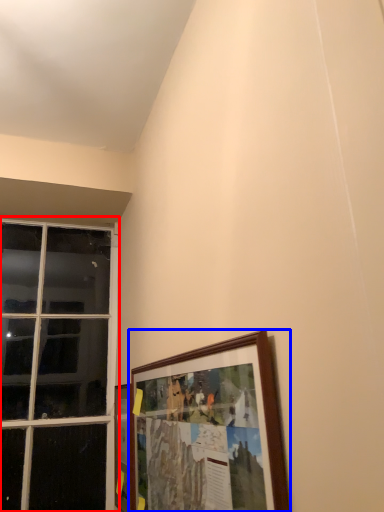
Question: Which point is further to the camera, window (highlighted by a red box) or picture frame (highlighted by a blue box)?

Choices:
 (A) window
 (B) picture frame

Answer: (A)